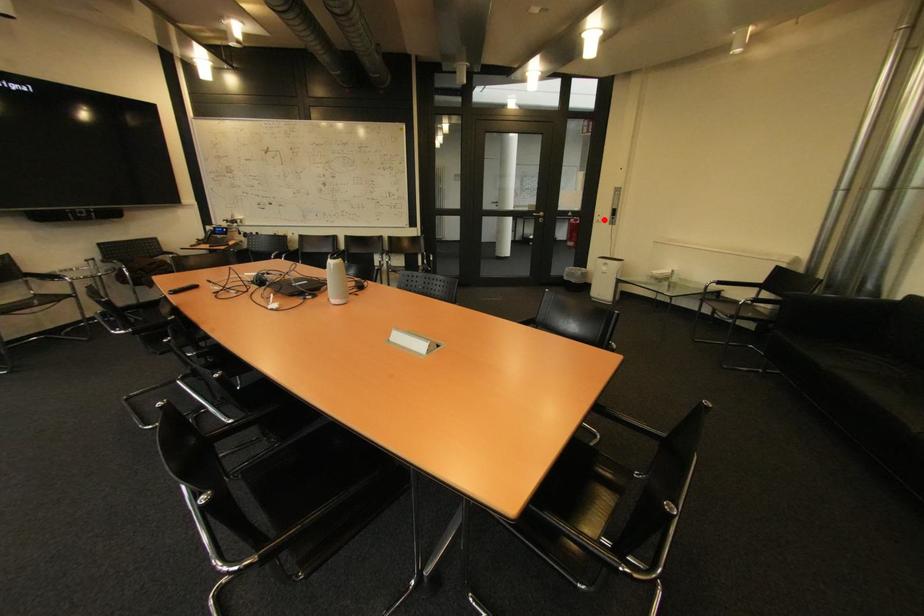
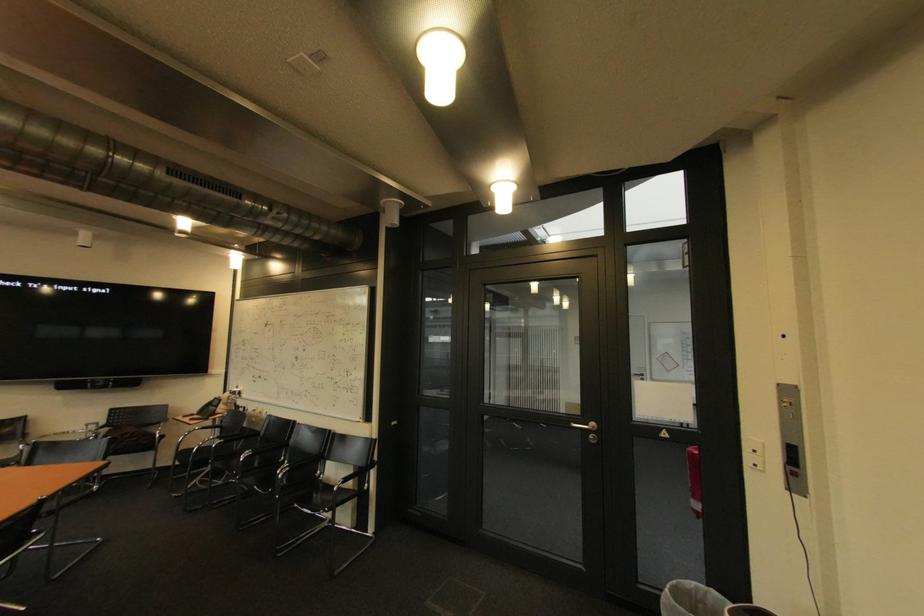
Question: I am providing you with two images of the same scene from different viewpoints. In image1, a red point is highlighted. Considering the same 3D point in image2, which of the following is correct?

Choices:
 (A) It is closer
 (B) It is farther

Answer: (B)